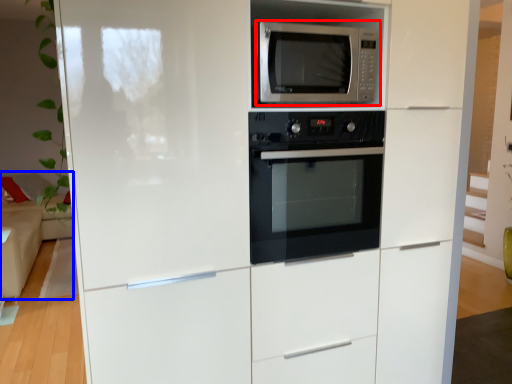
Question: Which object is further to the camera taking this photo, microwave oven (highlighted by a red box) or couch (highlighted by a blue box)?

Choices:
 (A) microwave oven
 (B) couch

Answer: (B)